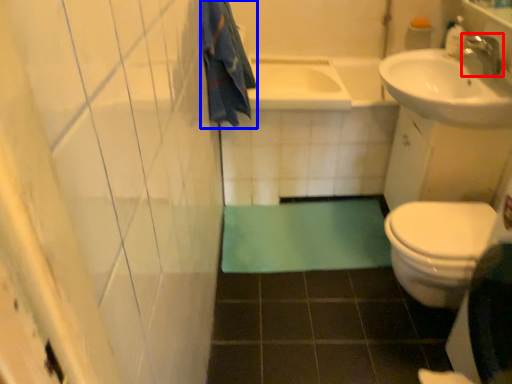
Question: Which of the following is the closest to the observer, tap (highlighted by a red box) or bath towel (highlighted by a blue box)?

Choices:
 (A) tap
 (B) bath towel

Answer: (B)